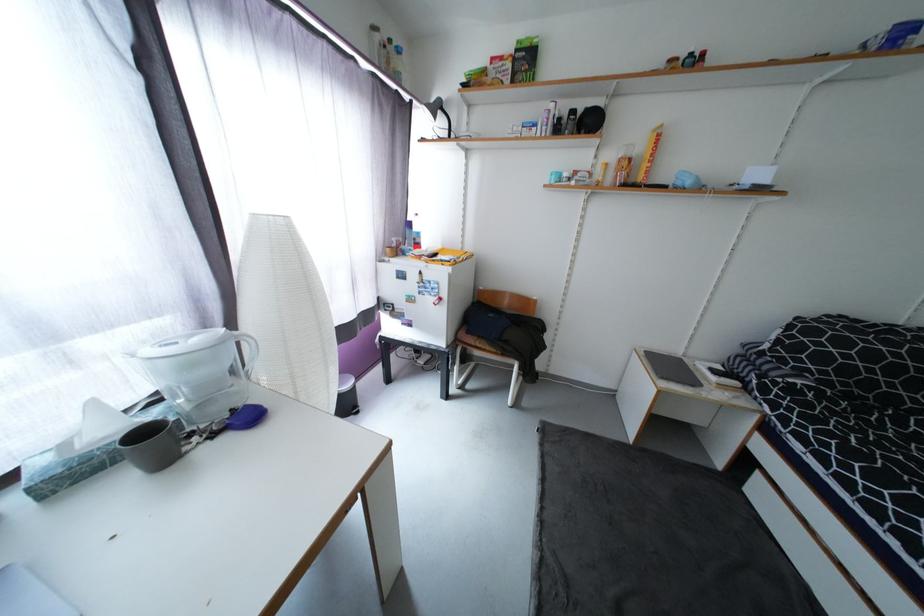
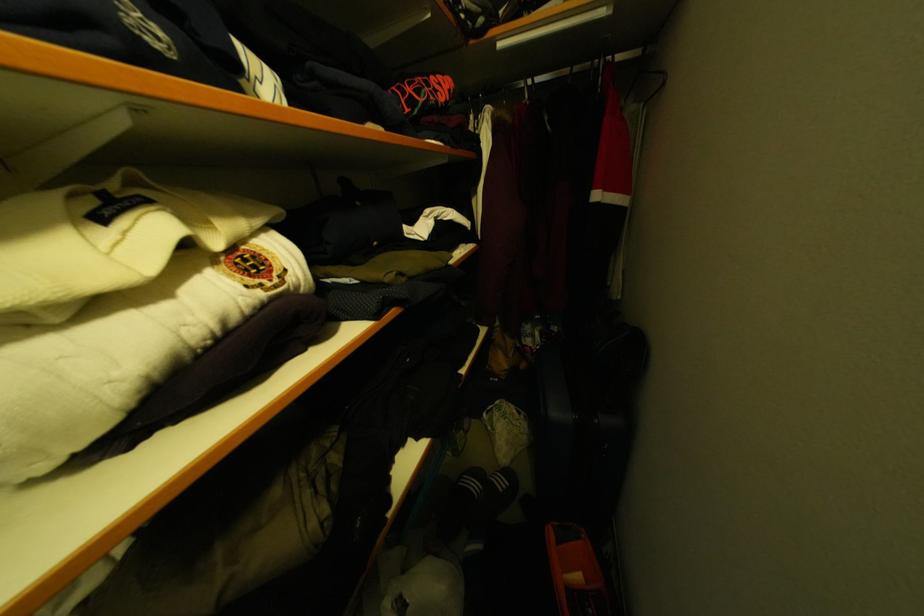
Question: What movement of the cameraman would produce the second image?

Choices:
 (A) Left
 (B) Right
 (C) Forward
 (D) Backward

Answer: (B)